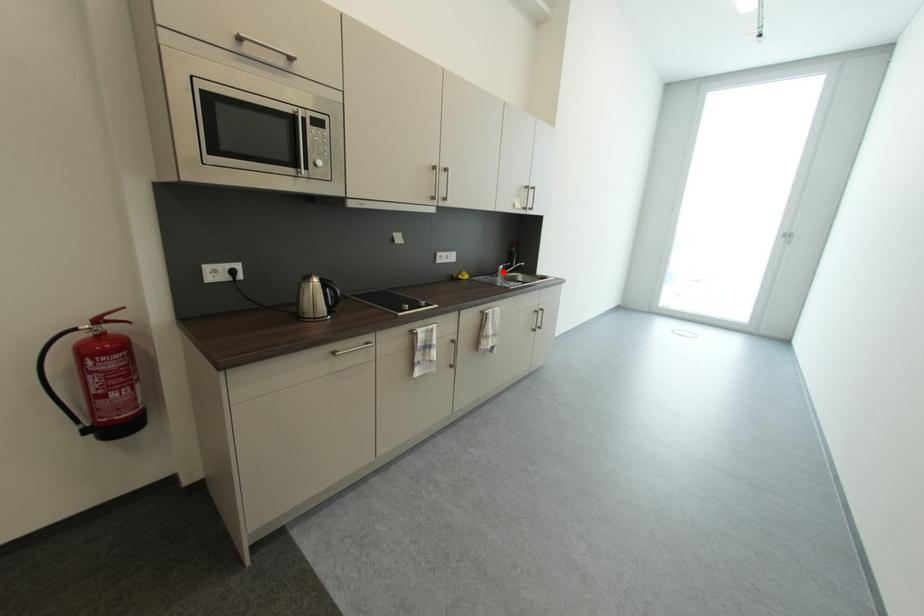
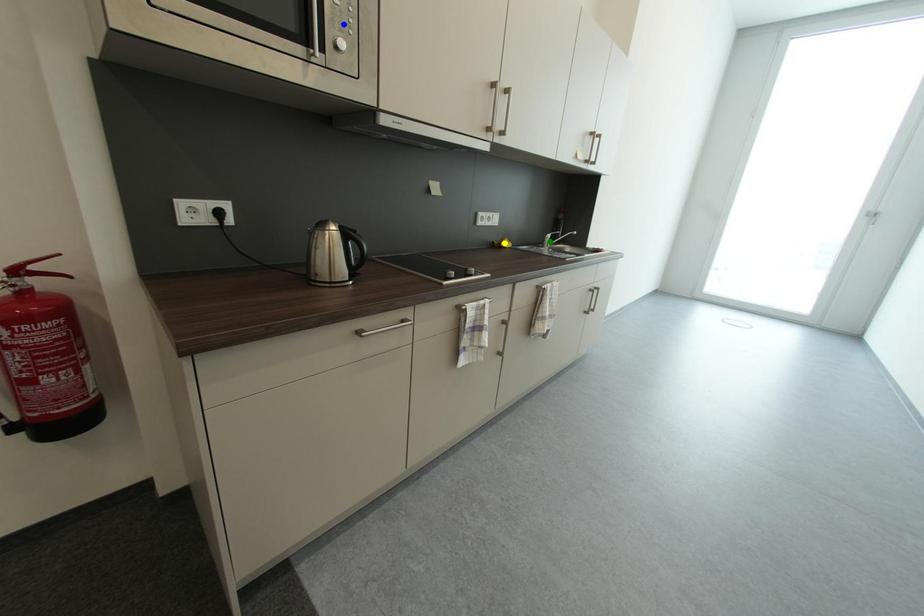
Question: I am providing you with two images of the same scene from different viewpoints. A red point is marked on the first image. You are given multiple points on the second image. Which mark in image 2 goes with the point in image 1?

Choices:
 (A) yellow point
 (B) blue point
 (C) green point

Answer: (C)